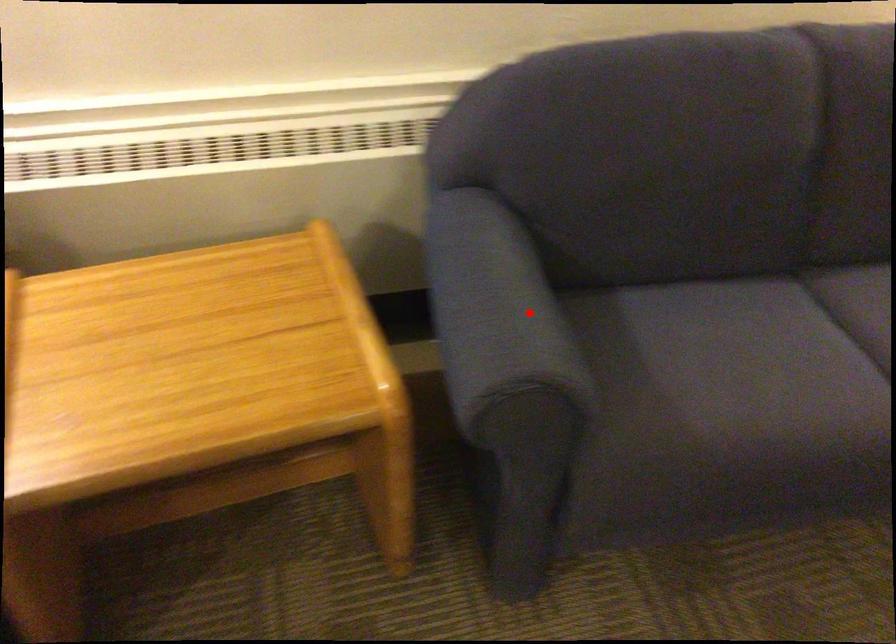
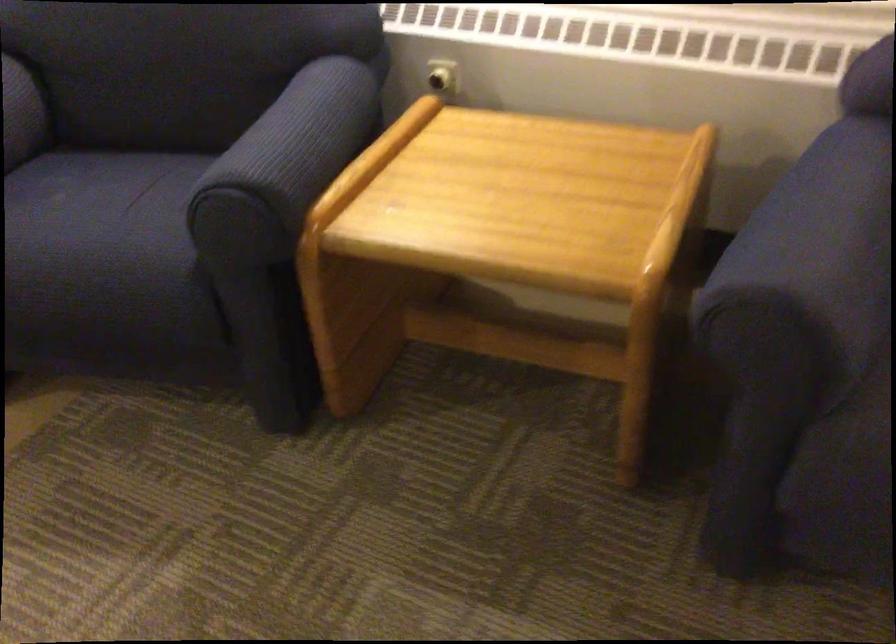
Where in the second image is the point corresponding to the highlighted location from the first image?

(821, 238)